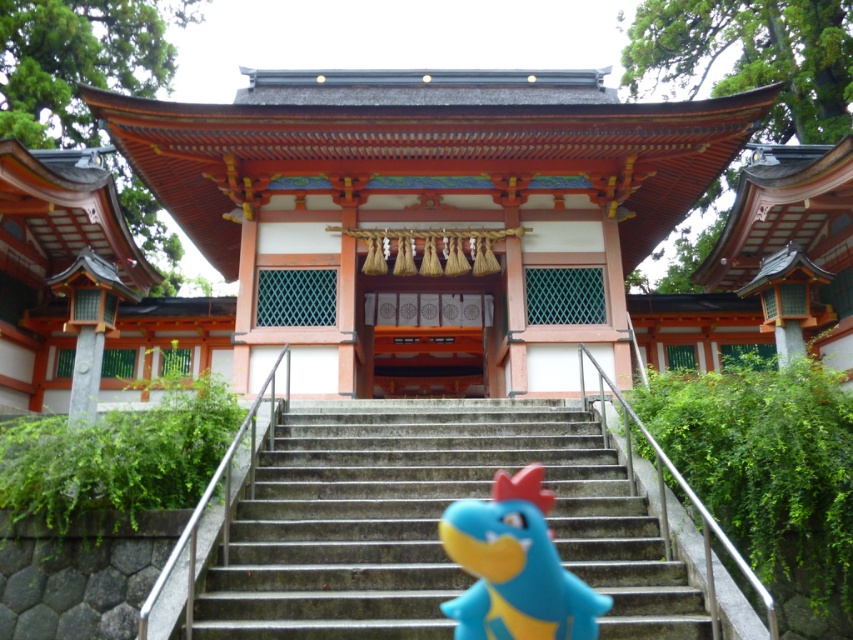
Question: Which point is closer to the camera?

Choices:
 (A) (619, 570)
 (B) (491, 499)

Answer: (A)

Question: Does concrete stairs at center have a lesser width compared to blue rubber toy at center?

Choices:
 (A) no
 (B) yes

Answer: (A)

Question: Which point is closer to the camera?

Choices:
 (A) concrete stairs at center
 (B) blue rubber toy at center

Answer: (B)

Question: Can you confirm if concrete stairs at center is positioned to the left of blue rubber toy at center?

Choices:
 (A) yes
 (B) no

Answer: (A)

Question: Among these objects, which one is nearest to the camera?

Choices:
 (A) blue rubber toy at center
 (B) concrete stairs at center

Answer: (A)

Question: Where is concrete stairs at center located in relation to blue rubber toy at center in the image?

Choices:
 (A) left
 (B) right

Answer: (A)